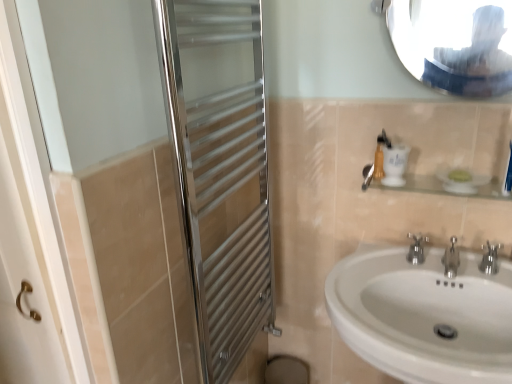
Question: Is chrome metallic faucet at sink center, marked as the first tap in a left-to-right arrangement, wider or thinner than white ceramic sink at lower right?

Choices:
 (A) thin
 (B) wide

Answer: (A)

Question: Considering the positions of chrome metallic faucet at sink center, marked as the first tap in a left-to-right arrangement, and white ceramic sink at lower right in the image, is chrome metallic faucet at sink center, marked as the first tap in a left-to-right arrangement, taller or shorter than white ceramic sink at lower right?

Choices:
 (A) short
 (B) tall

Answer: (A)

Question: Estimate the real-world distances between objects in this image. Which object is closer to the clear glass shelf at upper right?

Choices:
 (A) white ceramic sink at lower right
 (B) chrome metallic faucet at sink center, which appears as the 3th tap when viewed from the right
 (C) glossy metallic mirror at upper center
 (D) polished chrome towel rack at left
 (E) silver metallic tap at center, arranged as the second tap when viewed from the right

Answer: (B)

Question: Which is farther from the clear glass shelf at upper right?

Choices:
 (A) polished metallic faucet at lower right, which is counted as the third tap, starting from the left
 (B) silver metallic tap at center, arranged as the second tap when viewed from the right
 (C) glossy metallic mirror at upper center
 (D) chrome metallic faucet at sink center, which appears as the 3th tap when viewed from the right
 (E) polished chrome towel rack at left

Answer: (E)